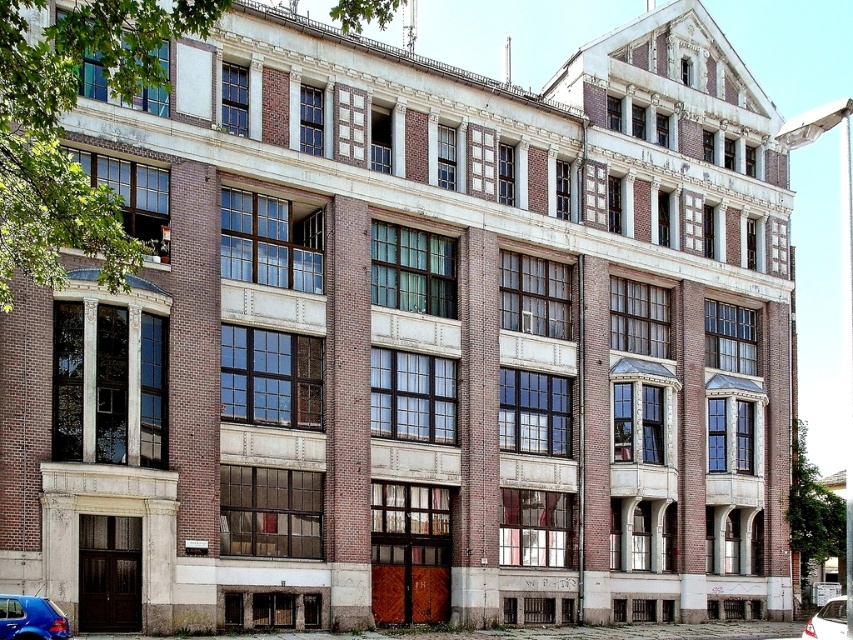
Does shiny blue car at lower left appear on the right side of white glossy car at lower right?

No, shiny blue car at lower left is not to the right of white glossy car at lower right.

Which is in front, point (9, 611) or point (844, 634)?

Point (9, 611) is more forward.

This screenshot has width=853, height=640. Find the location of `shiny blue car at lower left`. shiny blue car at lower left is located at coordinates (30, 618).